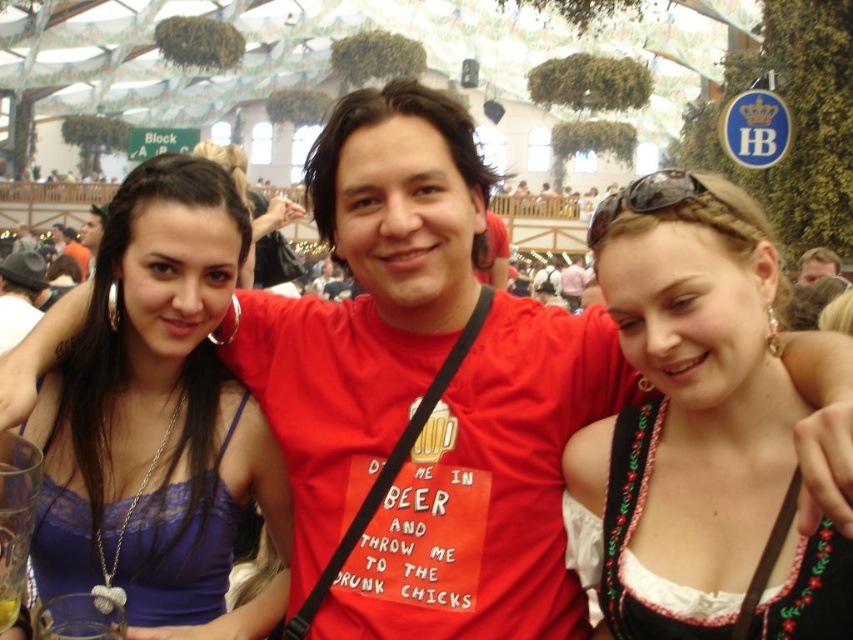
Question: Among these points, which one is farthest from the camera?

Choices:
 (A) (653, 173)
 (B) (204, 176)

Answer: (B)

Question: Which object appears closest to the camera in this image?

Choices:
 (A) matte black hair at center
 (B) matte black hair at upper left

Answer: (A)

Question: Is white embroidered dirndl at center wider than matte black hair at center?

Choices:
 (A) no
 (B) yes

Answer: (A)

Question: Does matte black hair at center have a greater width compared to smooth brown leather jacket at upper center?

Choices:
 (A) no
 (B) yes

Answer: (B)

Question: Does matte black sunglasses at upper center have a greater width compared to smooth brown leather jacket at upper center?

Choices:
 (A) yes
 (B) no

Answer: (A)

Question: Which object appears closest to the camera in this image?

Choices:
 (A) matte black hair at center
 (B) matte black hair at upper left
 (C) white embroidered dirndl at center
 (D) smooth brown leather jacket at upper center

Answer: (C)